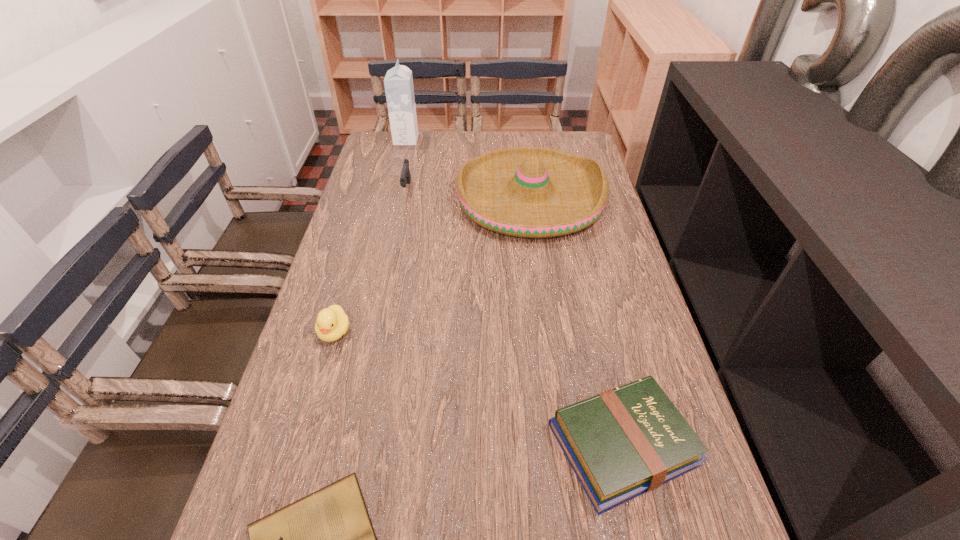
Find the location of `object that is at the far right corner`. object that is at the far right corner is located at coordinates (531, 192).

Where is `vacant space at the far edge of the desktop`? Image resolution: width=960 pixels, height=540 pixels. vacant space at the far edge of the desktop is located at coordinates (440, 136).

Where is `vacant space at the left edge of the desktop`? Image resolution: width=960 pixels, height=540 pixels. vacant space at the left edge of the desktop is located at coordinates (375, 177).

The height and width of the screenshot is (540, 960). I want to click on vacant space at the right edge of the desktop, so click(618, 374).

At what (x,y) coordinates should I click in order to perform the action: click on vacant point located between the carton and the third nearest object. Please return your answer as a coordinate pair (x, y). Looking at the image, I should click on (371, 236).

Find the location of a particular element. The image size is (960, 540). free space that is in between the farthest object and the right book is located at coordinates (515, 292).

This screenshot has width=960, height=540. What are the coordinates of `free space that is in between the right book and the carton` in the screenshot? It's located at (515, 292).

This screenshot has height=540, width=960. What are the coordinates of `vacant region between the right book and the third nearest object` in the screenshot? It's located at (x=479, y=388).

The width and height of the screenshot is (960, 540). Find the location of `free space between the tallest object and the right book`. free space between the tallest object and the right book is located at coordinates tap(515, 292).

You are a GUI agent. You are given a task and a screenshot of the screen. Output one action in this format:
    pyautogui.click(x=<x>, y=<y>)
    Task: Click on the unoccupied area between the taller book and the sombrero
    This screenshot has height=540, width=960.
    Given the screenshot: What is the action you would take?
    pyautogui.click(x=576, y=321)